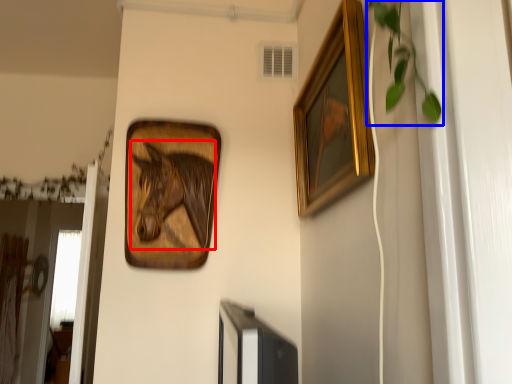
Question: Among these objects, which one is nearest to the camera, animal (highlighted by a red box) or plant (highlighted by a blue box)?

Choices:
 (A) animal
 (B) plant

Answer: (B)